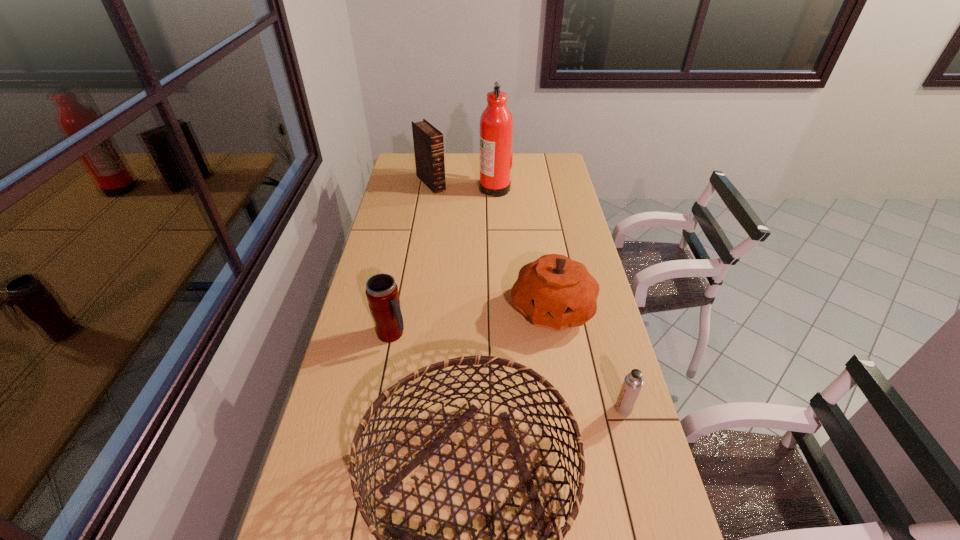
You are a GUI agent. You are given a task and a screenshot of the screen. Output one action in this format:
    pyautogui.click(x=<x>, y=<y>)
    Task: Click on the free region located 0.330m on the front of the fifth shortest object
    
    Given the screenshot: What is the action you would take?
    pyautogui.click(x=422, y=235)

Image resolution: width=960 pixels, height=540 pixels. Find the location of `vacant space positioned 0.370m on the front-facing side of the pumpkin`. vacant space positioned 0.370m on the front-facing side of the pumpkin is located at coordinates (576, 453).

I want to click on vacant space located 0.190m on the side with the handle of the taller thermos bottle, so click(466, 334).

Find the location of a particular element. free space located on the left of the shorter thermos bottle is located at coordinates (473, 409).

Locate an element on the screen. object situated at the far edge is located at coordinates (428, 141).

Image resolution: width=960 pixels, height=540 pixels. What are the coordinates of `Bible that is at the left edge` in the screenshot? It's located at (428, 141).

Locate an element on the screen. Image resolution: width=960 pixels, height=540 pixels. thermos bottle that is positioned at the left edge is located at coordinates (382, 294).

This screenshot has height=540, width=960. I want to click on pumpkin that is at the right edge, so click(x=555, y=292).

At what (x,y) coordinates should I click in order to perform the action: click on thermos bottle positioned at the right edge. Please return your answer as a coordinate pair (x, y). Looking at the image, I should click on (x=633, y=382).

This screenshot has width=960, height=540. Identify the location of object at the far left corner. (428, 141).